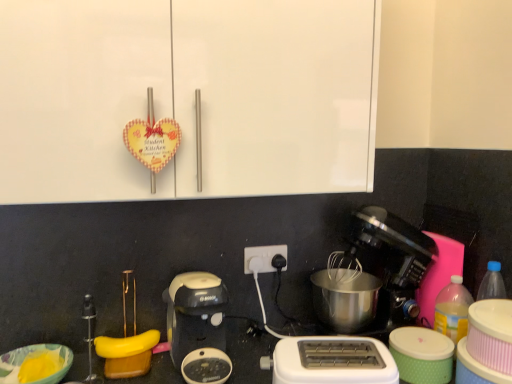
Question: Is the position of black plastic coffee maker at lower center, the second coffee maker viewed from the right, more distant than that of black plastic power plugs at center?

Choices:
 (A) yes
 (B) no

Answer: (B)

Question: From a real-world perspective, is black plastic coffee maker at lower center, which is counted as the first coffee maker, starting from the left, on black plastic power plugs at center?

Choices:
 (A) yes
 (B) no

Answer: (B)

Question: Is black plastic coffee maker at lower center, which is counted as the first coffee maker, starting from the left, at the left side of black plastic power plugs at center?

Choices:
 (A) no
 (B) yes

Answer: (B)

Question: Does black plastic coffee maker at lower center, which is counted as the first coffee maker, starting from the left, appear on the right side of black plastic power plugs at center?

Choices:
 (A) no
 (B) yes

Answer: (A)

Question: Can you confirm if black plastic coffee maker at lower center, which is counted as the first coffee maker, starting from the left, is taller than black plastic power plugs at center?

Choices:
 (A) yes
 (B) no

Answer: (A)

Question: Considering the positions of point (116, 347) and point (260, 256), is point (116, 347) closer or farther from the camera than point (260, 256)?

Choices:
 (A) farther
 (B) closer

Answer: (B)

Question: Is yellow rubber band at lower center taller or shorter than black plastic power plugs at center?

Choices:
 (A) tall
 (B) short

Answer: (B)

Question: From the image's perspective, relative to black plastic power plugs at center, is yellow rubber band at lower center above or below?

Choices:
 (A) below
 (B) above

Answer: (A)

Question: Choose the correct answer: Is yellow rubber band at lower center inside black plastic power plugs at center or outside it?

Choices:
 (A) inside
 (B) outside

Answer: (B)

Question: Is yellow rubber band at lower center bigger or smaller than matte yellow bowl at lower left?

Choices:
 (A) big
 (B) small

Answer: (B)

Question: From a real-world perspective, is yellow rubber band at lower center physically located above or below matte yellow bowl at lower left?

Choices:
 (A) above
 (B) below

Answer: (B)

Question: In terms of height, does yellow rubber band at lower center look taller or shorter compared to matte yellow bowl at lower left?

Choices:
 (A) short
 (B) tall

Answer: (B)

Question: Is yellow rubber band at lower center wider or thinner than matte yellow bowl at lower left?

Choices:
 (A) wide
 (B) thin

Answer: (B)

Question: Is black plastic coffee maker at center right, acting as the 2th coffee maker starting from the left, bigger or smaller than yellow rubber band at lower center?

Choices:
 (A) big
 (B) small

Answer: (A)

Question: From their relative heights in the image, would you say black plastic coffee maker at center right, acting as the 2th coffee maker starting from the left, is taller or shorter than yellow rubber band at lower center?

Choices:
 (A) tall
 (B) short

Answer: (A)